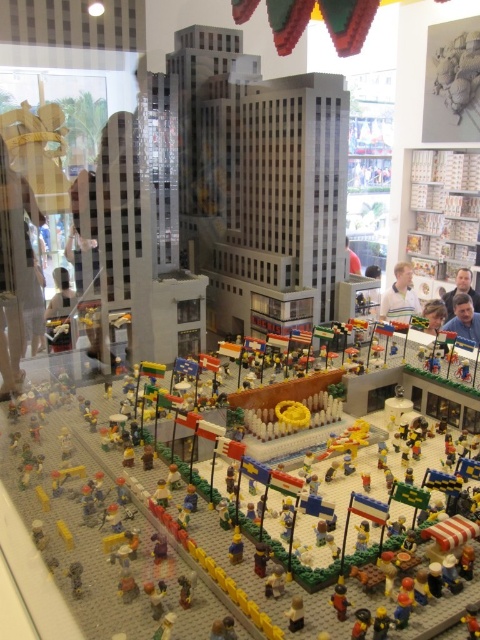
Question: Is smooth blue shirt at center positioned behind yellow matte figure at center?

Choices:
 (A) yes
 (B) no

Answer: (A)

Question: Is white shirt at upper center wider than brick-like yellow car at center?

Choices:
 (A) no
 (B) yes

Answer: (B)

Question: Can you confirm if smooth blue shirt at center is smaller than brick-like yellow car at center?

Choices:
 (A) no
 (B) yes

Answer: (A)

Question: Which point is farther from the camera taking this photo?

Choices:
 (A) (411, 298)
 (B) (467, 310)
 (C) (477, 634)

Answer: (A)

Question: Which of the following is the closest to the observer?

Choices:
 (A) pyautogui.click(x=336, y=600)
 (B) pyautogui.click(x=463, y=289)
 (C) pyautogui.click(x=470, y=611)

Answer: (C)

Question: Which point is farther to the camera?

Choices:
 (A) (465, 614)
 (B) (456, 296)

Answer: (B)